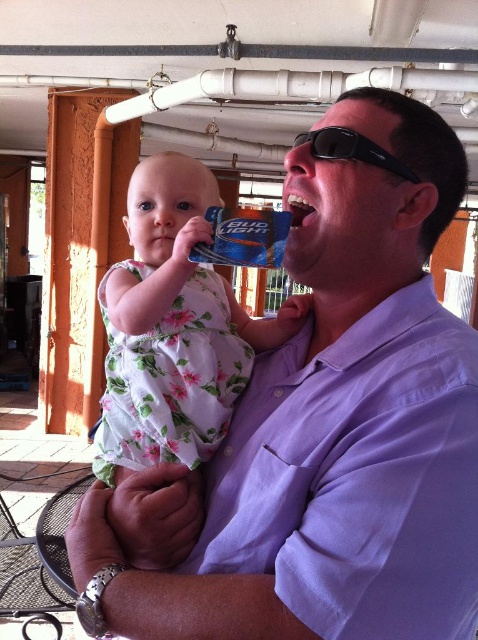
Question: Does white floral dress at center have a greater width compared to white glossy teeth at center?

Choices:
 (A) yes
 (B) no

Answer: (A)

Question: Which of the following is the farthest from the observer?

Choices:
 (A) white floral dress at center
 (B) black plastic sunglasses at upper center
 (C) purple cotton shirt at center
 (D) white glossy teeth at center

Answer: (A)

Question: Is white floral dress at center further to the viewer compared to white glossy teeth at center?

Choices:
 (A) yes
 (B) no

Answer: (A)

Question: Among these points, which one is nearest to the camera?

Choices:
 (A) (300, 220)
 (B) (369, 227)

Answer: (B)

Question: Which point is farther to the camera?

Choices:
 (A) white floral dress at center
 (B) black plastic sunglasses at upper center
 (C) white glossy teeth at center

Answer: (A)

Question: Observing the image, what is the correct spatial positioning of purple cotton shirt at center in reference to white floral dress at center?

Choices:
 (A) below
 (B) above

Answer: (A)